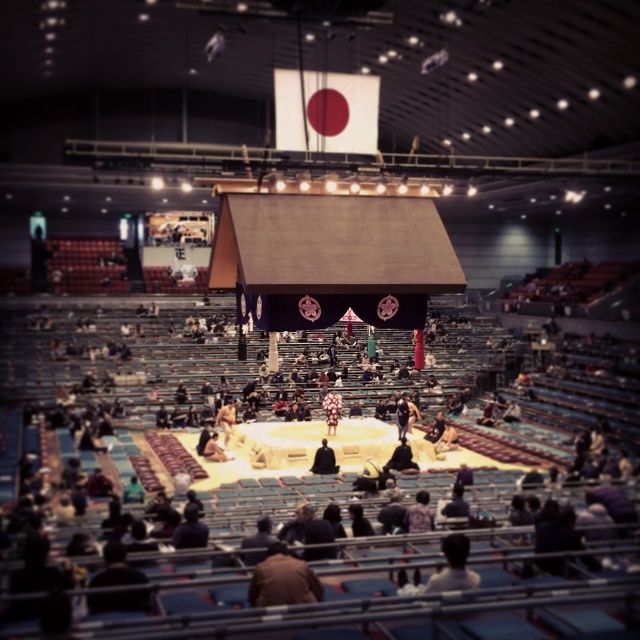
Question: Which of these objects is positioned closest to the silk black kimono at center?

Choices:
 (A) fluffy white kimono at center
 (B) dark brown leather jacket at center
 (C) dark blue fabric kimono at center
 (D) brown leather jacket at lower center

Answer: (B)

Question: Which point appears farthest from the camera in this image?

Choices:
 (A) (424, 506)
 (B) (289, 573)

Answer: (A)

Question: Can you confirm if dark blue fabric kimono at center is positioned above dark brown leather jacket at center?

Choices:
 (A) yes
 (B) no

Answer: (A)

Question: Can you confirm if silk black kimono at center is wider than fluffy white kimono at center?

Choices:
 (A) no
 (B) yes

Answer: (B)

Question: Which of the following is the farthest from the observer?

Choices:
 (A) (403, 456)
 (B) (324, 444)
 (C) (316, 588)

Answer: (A)

Question: Is dark blue fabric kimono at center to the right of silk black kimono at center from the viewer's perspective?

Choices:
 (A) no
 (B) yes

Answer: (B)